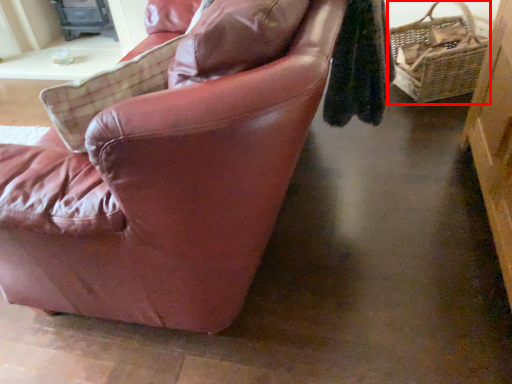
Question: In this image, where is picnic basket (annotated by the red box) located relative to chair?

Choices:
 (A) right
 (B) left

Answer: (A)